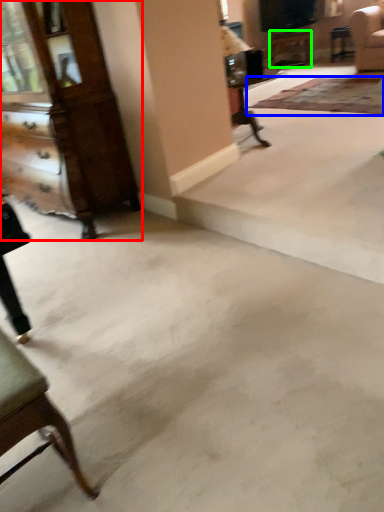
Question: Considering the real-world distances, which object is closest to dresser (highlighted by a red box)? mat (highlighted by a blue box) or table (highlighted by a green box).

Choices:
 (A) mat
 (B) table

Answer: (A)